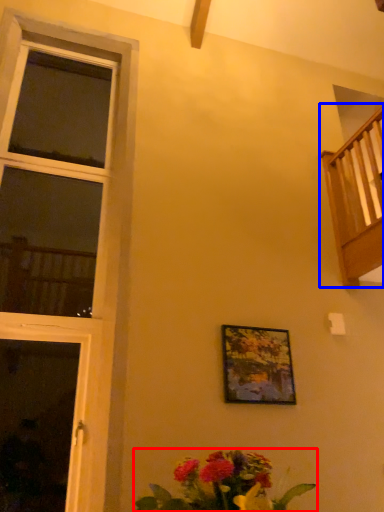
Question: Among these objects, which one is nearest to the camera, floral arrangement (highlighted by a red box) or balcony (highlighted by a blue box)?

Choices:
 (A) floral arrangement
 (B) balcony

Answer: (A)